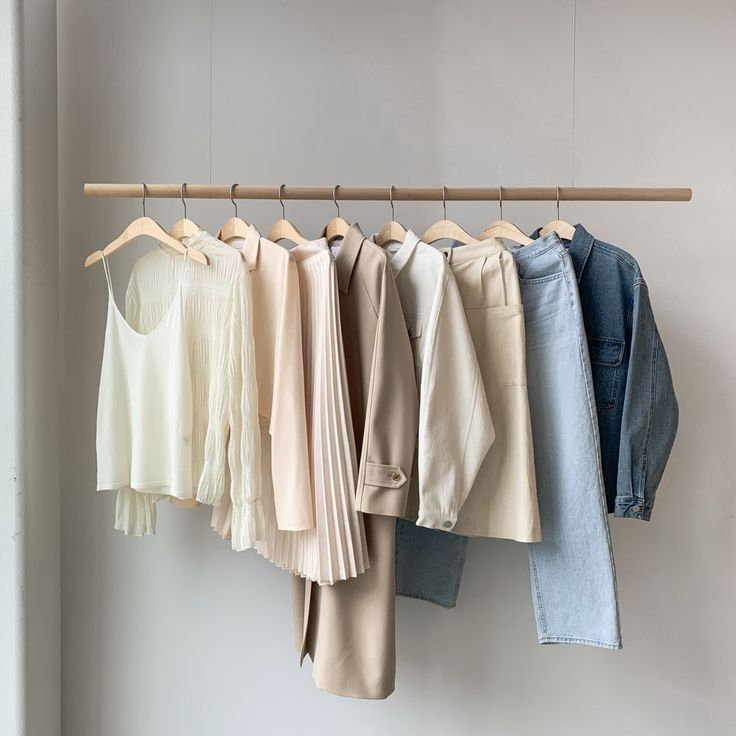
Image resolution: width=736 pixels, height=736 pixels. I want to click on clothes hanger, so click(152, 230), click(188, 229), click(233, 230), click(285, 233), click(339, 230), click(392, 232), click(445, 233), click(502, 230), click(562, 230).